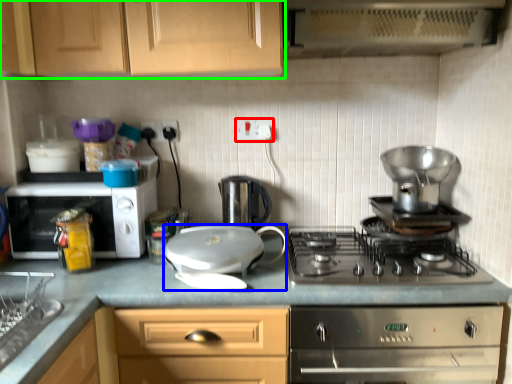
Question: Estimate the real-world distances between objects in this image. Which object is closer to electric outlet (highlighted by a red box), kitchen appliance (highlighted by a blue box) or cabinetry (highlighted by a green box)?

Choices:
 (A) kitchen appliance
 (B) cabinetry

Answer: (B)